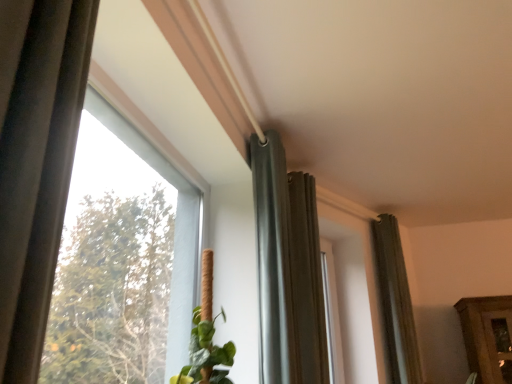
Question: Is dark gray fabric curtain at center, the first curtain when ordered from left to right, wider than transparent glass window at upper left?

Choices:
 (A) yes
 (B) no

Answer: (A)

Question: Is dark gray fabric curtain at center, positioned as the third curtain in right-to-left order, further to the viewer compared to transparent glass window at upper left?

Choices:
 (A) yes
 (B) no

Answer: (A)

Question: Is dark gray fabric curtain at center, the first curtain when ordered from left to right, smaller than transparent glass window at upper left?

Choices:
 (A) no
 (B) yes

Answer: (B)

Question: Is dark gray fabric curtain at center, the 3th curtain when ordered from back to front, in front of transparent glass window at upper left?

Choices:
 (A) yes
 (B) no

Answer: (B)

Question: From the image's perspective, is dark gray fabric curtain at center, the 3th curtain when ordered from back to front, located beneath transparent glass window at upper left?

Choices:
 (A) yes
 (B) no

Answer: (A)

Question: In the image, is dark gray fabric curtain at center, the first curtain when ordered from left to right, on the left side or the right side of dark gray fabric curtain at right, which ranks as the third curtain in front-to-back order?

Choices:
 (A) left
 (B) right

Answer: (A)

Question: Is dark gray fabric curtain at center, the first curtain when ordered from left to right, inside or outside of dark gray fabric curtain at right, the 3th curtain viewed from the left?

Choices:
 (A) outside
 (B) inside

Answer: (A)

Question: Considering the positions of dark gray fabric curtain at center, which ranks as the 1th curtain in front-to-back order, and dark gray fabric curtain at right, the 3th curtain viewed from the left, in the image, is dark gray fabric curtain at center, which ranks as the 1th curtain in front-to-back order, bigger or smaller than dark gray fabric curtain at right, the 3th curtain viewed from the left,?

Choices:
 (A) small
 (B) big

Answer: (B)

Question: In terms of height, does dark gray fabric curtain at center, positioned as the third curtain in right-to-left order, look taller or shorter compared to dark gray fabric curtain at right, the 3th curtain viewed from the left?

Choices:
 (A) short
 (B) tall

Answer: (A)

Question: From their relative heights in the image, would you say dark gray fabric curtain at center, the 3th curtain when ordered from back to front, is taller or shorter than matte gray curtain at center, the second curtain viewed from the right?

Choices:
 (A) tall
 (B) short

Answer: (B)

Question: Is dark gray fabric curtain at center, the 3th curtain when ordered from back to front, to the left or to the right of matte gray curtain at center, which appears as the 2th curtain when viewed from the front, in the image?

Choices:
 (A) right
 (B) left

Answer: (B)

Question: From the image's perspective, is dark gray fabric curtain at center, which ranks as the 1th curtain in front-to-back order, positioned above or below matte gray curtain at center, which appears as the 2th curtain when viewed from the front?

Choices:
 (A) below
 (B) above

Answer: (B)

Question: Would you say dark gray fabric curtain at center, the first curtain when ordered from left to right, is inside or outside matte gray curtain at center, the 2th curtain when ordered from left to right?

Choices:
 (A) inside
 (B) outside

Answer: (B)

Question: Looking at their shapes, would you say matte gray curtain at center, the second curtain viewed from the right, is wider or thinner than dark gray fabric curtain at center, the first curtain when ordered from left to right?

Choices:
 (A) wide
 (B) thin

Answer: (A)

Question: Does point (304, 233) appear closer or farther from the camera than point (265, 261)?

Choices:
 (A) closer
 (B) farther

Answer: (B)